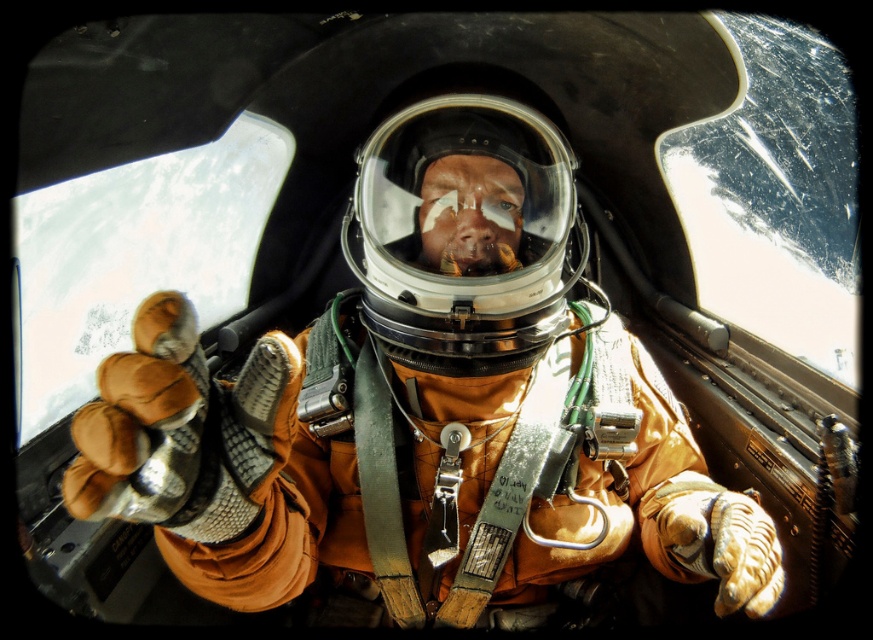
Question: Which object appears farthest from the camera in this image?

Choices:
 (A) orange fabric astronaut at center
 (B) transparent plastic helmet at center

Answer: (B)

Question: Can you confirm if orange fabric astronaut at center is positioned to the left of transparent plastic helmet at center?

Choices:
 (A) yes
 (B) no

Answer: (A)

Question: Where is orange fabric astronaut at center located in relation to transparent plastic helmet at center in the image?

Choices:
 (A) left
 (B) right

Answer: (A)

Question: Which point is closer to the camera?

Choices:
 (A) (333, 392)
 (B) (383, 252)

Answer: (B)

Question: In this image, where is orange fabric astronaut at center located relative to transparent plastic helmet at center?

Choices:
 (A) right
 (B) left

Answer: (B)